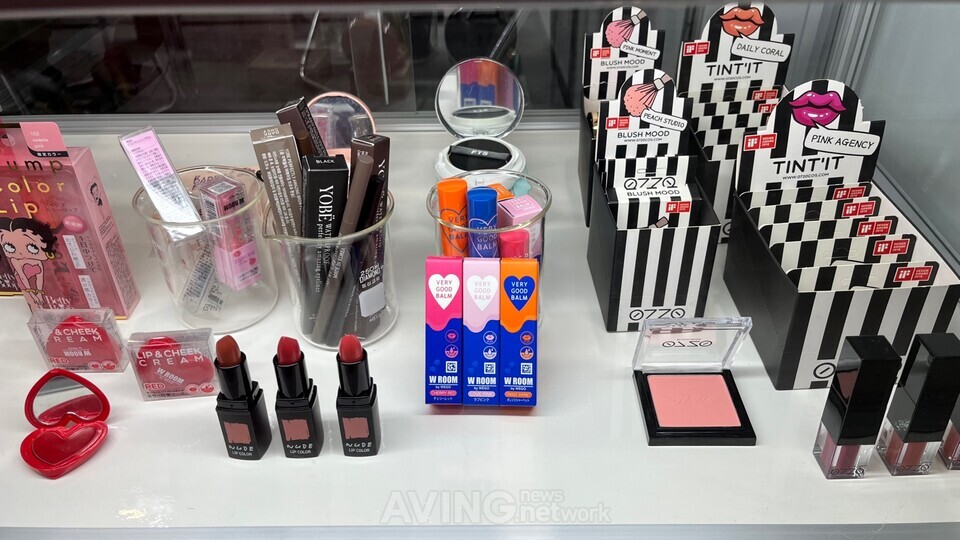
Where is `countertop`? Image resolution: width=960 pixels, height=540 pixels. countertop is located at coordinates (592, 424).